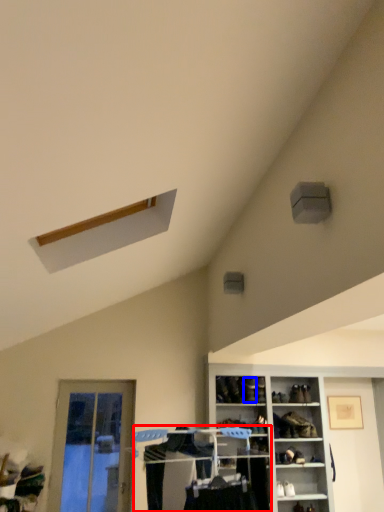
Question: Which object is further to the camera taking this photo, closet (highlighted by a red box) or shoe (highlighted by a blue box)?

Choices:
 (A) closet
 (B) shoe

Answer: (B)